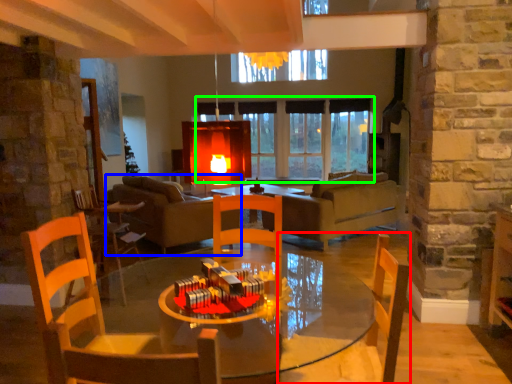
Question: Estimate the real-world distances between objects in this image. Which object is farther from chair (highlighted by a red box), studio couch (highlighted by a blue box) or window (highlighted by a green box)?

Choices:
 (A) studio couch
 (B) window

Answer: (B)